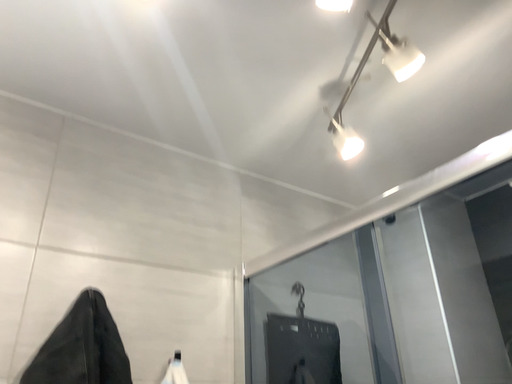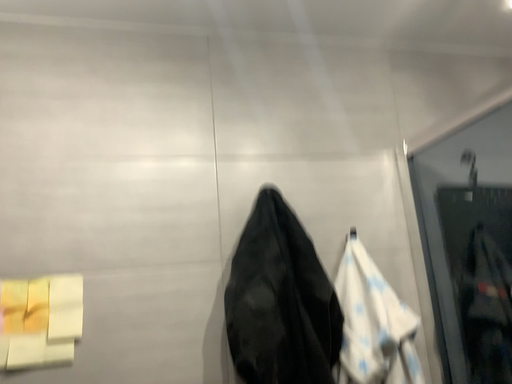
Question: How did the camera likely rotate when shooting the video?

Choices:
 (A) rotated upward
 (B) rotated downward

Answer: (B)